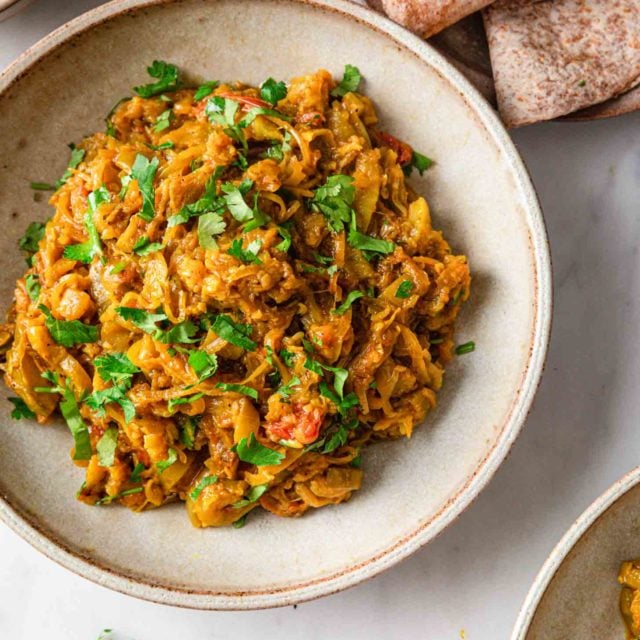
Where is `plate`? plate is located at coordinates (516, 228), (579, 605).